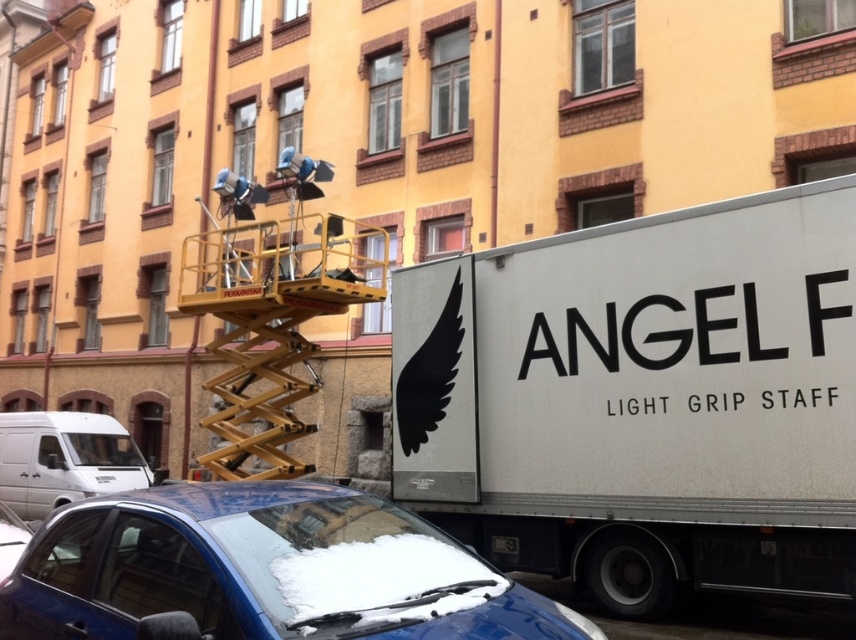
Is white matte van at lower left to the left of black plastic license plate at lower center from the viewer's perspective?

Correct, you'll find white matte van at lower left to the left of black plastic license plate at lower center.

Is white matte van at lower left shorter than black plastic license plate at lower center?

Incorrect, white matte van at lower left's height does not fall short of black plastic license plate at lower center's.

Measure the distance between point (x=10, y=499) and camera.

They are 43.10 feet apart.

The image size is (856, 640). Find the location of `white matte van at lower left`. white matte van at lower left is located at coordinates (64, 460).

From the picture: Which is below, blue matte car at lower center or black plastic license plate at lower center?

black plastic license plate at lower center is below.

Measure the distance between blue matte car at lower center and camera.

They are 2.63 meters apart.

Identify the location of blue matte car at lower center. This screenshot has height=640, width=856. (263, 572).

Can you confirm if white matte truck at center is smaller than black plastic license plate at lower center?

Incorrect, white matte truck at center is not smaller in size than black plastic license plate at lower center.

Is white matte truck at center thinner than black plastic license plate at lower center?

Incorrect, white matte truck at center's width is not less than black plastic license plate at lower center's.

Which is behind, point (396, 301) or point (503, 552)?

The point (396, 301) is more distant.

At what (x,y) coordinates should I click in order to perform the action: click on white matte truck at center. Please return your answer as a coordinate pair (x, y). The height and width of the screenshot is (640, 856). Looking at the image, I should click on (642, 400).